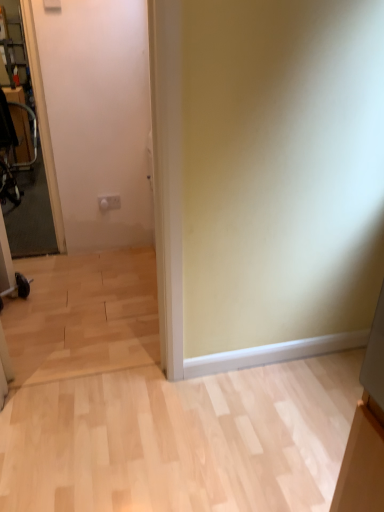
Locate an element on the screen. The image size is (384, 512). transparent glass door at left is located at coordinates (31, 160).

Describe the element at coordinates (31, 160) in the screenshot. I see `transparent glass door at left` at that location.

In order to face transparent glass door at left, should I rotate leftwards or rightwards?

You should look left and rotate roughly 22.638 degrees.

What is the approximate width of metallic silver swivel chair at left?

The width of metallic silver swivel chair at left is 43.67 centimeters.

This screenshot has width=384, height=512. Find the location of `metallic silver swivel chair at left`. metallic silver swivel chair at left is located at coordinates (12, 147).

This screenshot has width=384, height=512. Describe the element at coordinates (12, 147) in the screenshot. I see `metallic silver swivel chair at left` at that location.

The height and width of the screenshot is (512, 384). Identify the location of transparent glass door at left. (31, 160).

Between metallic silver swivel chair at left and transparent glass door at left, which one appears on the right side from the viewer's perspective?

Positioned to the right is transparent glass door at left.

Is metallic silver swivel chair at left behind transparent glass door at left?

Yes, metallic silver swivel chair at left is behind transparent glass door at left.

Does point (8, 180) lie behind point (12, 249)?

Yes.

From the image's perspective, who appears lower, metallic silver swivel chair at left or transparent glass door at left?

transparent glass door at left is shown below in the image.

From a real-world perspective, is metallic silver swivel chair at left positioned under transparent glass door at left based on gravity?

Correct, in the physical world, metallic silver swivel chair at left is lower than transparent glass door at left.

In the scene shown: Between metallic silver swivel chair at left and transparent glass door at left, which one has larger width?

Wider between the two is metallic silver swivel chair at left.

Considering the sizes of metallic silver swivel chair at left and transparent glass door at left in the image, is metallic silver swivel chair at left taller or shorter than transparent glass door at left?

In the image, metallic silver swivel chair at left appears to be shorter than transparent glass door at left.

Based on their sizes in the image, would you say metallic silver swivel chair at left is bigger or smaller than transparent glass door at left?

Considering their sizes, metallic silver swivel chair at left takes up more space than transparent glass door at left.

Would you say metallic silver swivel chair at left contains transparent glass door at left?

Definitely not — transparent glass door at left is not inside metallic silver swivel chair at left.

From the picture: Is there a large distance between metallic silver swivel chair at left and transparent glass door at left?

No, there isn't a large distance between metallic silver swivel chair at left and transparent glass door at left.

Is metallic silver swivel chair at left looking in the opposite direction of transparent glass door at left?

That's not correct — metallic silver swivel chair at left is not looking away from transparent glass door at left.

How many degrees apart are the facing directions of metallic silver swivel chair at left and transparent glass door at left?

The angular difference between metallic silver swivel chair at left and transparent glass door at left is 90.8 degrees.

You are a GUI agent. You are given a task and a screenshot of the screen. Output one action in this format:
    pyautogui.click(x=<x>, y=<y>)
    Task: Click on the swivel chair that appears below the transparent glass door at left (from a real-world perspective)
    
    Given the screenshot: What is the action you would take?
    pyautogui.click(x=12, y=147)

Considering the relative positions of transparent glass door at left and metallic silver swivel chair at left in the image provided, is transparent glass door at left to the left or to the right of metallic silver swivel chair at left?

From the image, it's evident that transparent glass door at left is to the right of metallic silver swivel chair at left.

Relative to metallic silver swivel chair at left, is transparent glass door at left in front or behind?

In the image, transparent glass door at left appears in front of metallic silver swivel chair at left.

Is point (60, 226) farther from camera compared to point (1, 150)?

No, (60, 226) is closer to viewer.

From the image's perspective, is transparent glass door at left on top of metallic silver swivel chair at left?

Incorrect, from the image's perspective, transparent glass door at left is lower than metallic silver swivel chair at left.

From a real-world perspective, is transparent glass door at left positioned under metallic silver swivel chair at left based on gravity?

No, from a real-world perspective, transparent glass door at left is not below metallic silver swivel chair at left.

Is transparent glass door at left wider or thinner than metallic silver swivel chair at left?

Clearly, transparent glass door at left has less width compared to metallic silver swivel chair at left.

From the picture: Considering the relative sizes of transparent glass door at left and metallic silver swivel chair at left in the image provided, is transparent glass door at left taller than metallic silver swivel chair at left?

Yes, transparent glass door at left is taller than metallic silver swivel chair at left.

In the scene shown: Looking at the image, does transparent glass door at left seem bigger or smaller compared to metallic silver swivel chair at left?

transparent glass door at left is smaller than metallic silver swivel chair at left.

Does transparent glass door at left contain metallic silver swivel chair at left?

Definitely not — metallic silver swivel chair at left is not inside transparent glass door at left.

Is transparent glass door at left far away from metallic silver swivel chair at left?

No.

Is transparent glass door at left looking in the opposite direction of metallic silver swivel chair at left?

Yes.

How many degrees apart are the facing directions of transparent glass door at left and metallic silver swivel chair at left?

The facing directions of transparent glass door at left and metallic silver swivel chair at left are 90.8 degrees apart.

How far apart are transparent glass door at left and metallic silver swivel chair at left?

They are 7.06 inches apart.

Find the location of a particular element. Image resolution: width=384 pixels, height=512 pixels. glass door on the right of metallic silver swivel chair at left is located at coordinates (31, 160).

Where is `glass door lying on the right of metallic silver swivel chair at left`? This screenshot has width=384, height=512. glass door lying on the right of metallic silver swivel chair at left is located at coordinates (31, 160).

Locate an element on the screen. This screenshot has height=512, width=384. glass door in front of the metallic silver swivel chair at left is located at coordinates (31, 160).